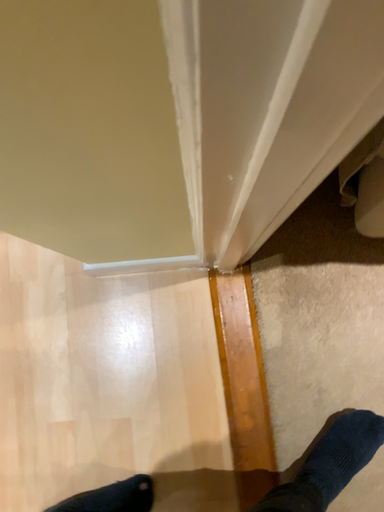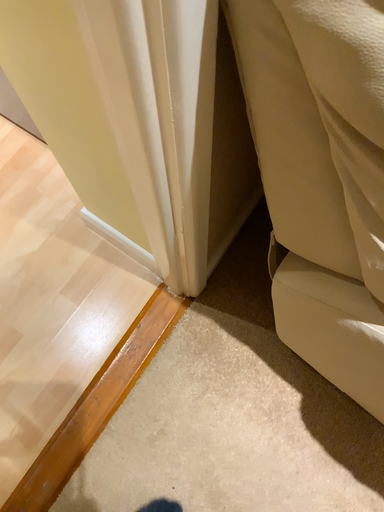
Question: Which way did the camera rotate in the video?

Choices:
 (A) rotated downward
 (B) rotated upward

Answer: (B)